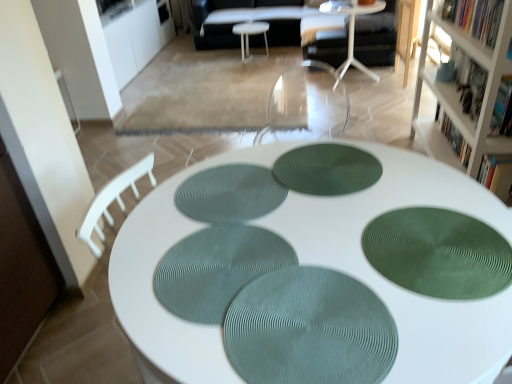
Where is `vacant point to the right of green textured placemat at center`? The height and width of the screenshot is (384, 512). vacant point to the right of green textured placemat at center is located at coordinates (438, 296).